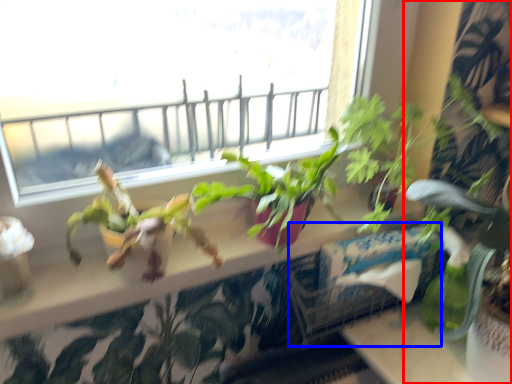
Question: Which of the following is the farthest to the observer, houseplant (highlighted by a red box) or window box (highlighted by a blue box)?

Choices:
 (A) houseplant
 (B) window box

Answer: (B)